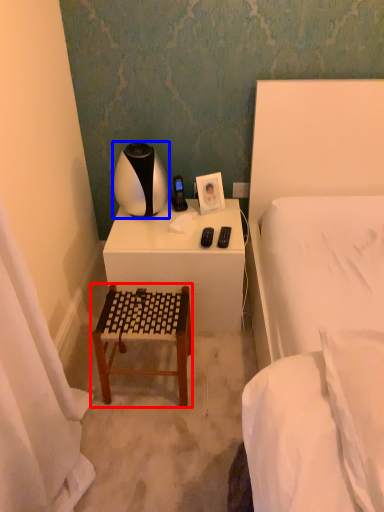
Question: Which object appears farthest to the camera in this image, furniture (highlighted by a red box) or table lamp (highlighted by a blue box)?

Choices:
 (A) furniture
 (B) table lamp

Answer: (B)